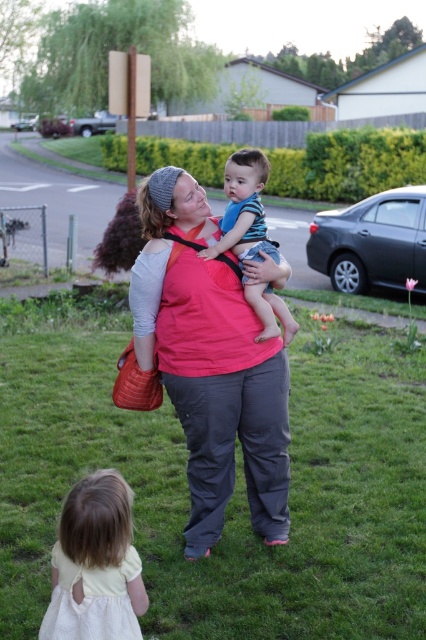
You are a photographer trying to capture a photo of the blue striped shirt at center and the white cotton dress at lower left. Which one should you focus on first to ensure both are in focus?

The white cotton dress at lower left is closer to the viewer than the blue striped shirt at center, so you should focus on the white cotton dress at lower left first to ensure both are in focus.

Based on the scene description, which object is wider? The green grass at lower center or the matte pink shirt at center?

A: The green grass at lower center is wider than the matte pink shirt at center.